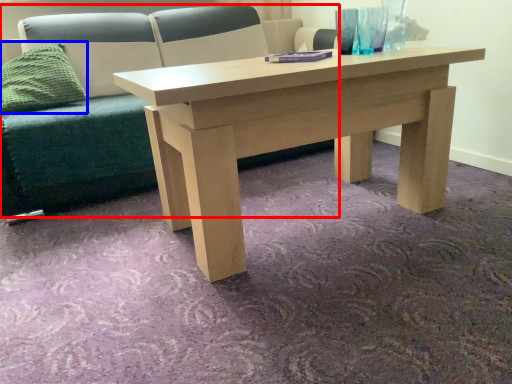
Question: Among these objects, which one is nearest to the camera, studio couch (highlighted by a red box) or pillow (highlighted by a blue box)?

Choices:
 (A) studio couch
 (B) pillow

Answer: (A)